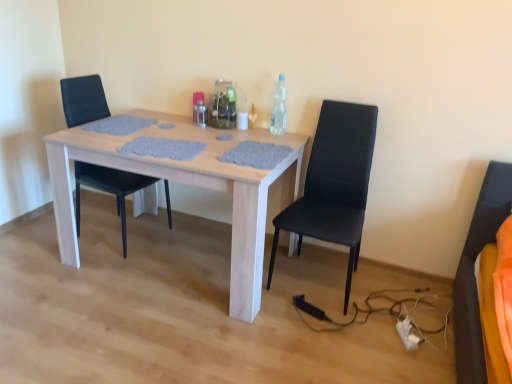
Where is `free spot to the right of black leather chair at right, which is counted as the 1th chair, starting from the right`? free spot to the right of black leather chair at right, which is counted as the 1th chair, starting from the right is located at coordinates (398, 299).